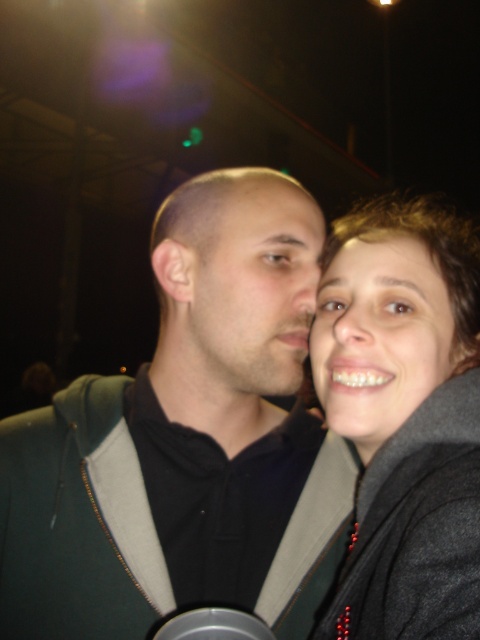
Is matte black face at center bigger than metallic silver cup at center?

Yes, matte black face at center is bigger than metallic silver cup at center.

Where is `matte black face at center`? matte black face at center is located at coordinates (253, 285).

Can you confirm if dark green hoodie at center is smaller than matte black face at center?

No, dark green hoodie at center is not smaller than matte black face at center.

Is dark green hoodie at center bigger than matte black face at center?

Indeed, dark green hoodie at center has a larger size compared to matte black face at center.

Is point (36, 582) positioned behind point (248, 304)?

Yes, it is behind point (248, 304).

Find the location of a particular element. This screenshot has height=640, width=480. dark green hoodie at center is located at coordinates (180, 451).

Can you confirm if smooth skin face at center is positioned above metallic silver cup at center?

Indeed, smooth skin face at center is positioned over metallic silver cup at center.

Between point (375, 268) and point (187, 618), which one is positioned behind?

Positioned behind is point (375, 268).

Is point (407, 352) less distant than point (177, 614)?

That is True.

I want to click on smooth skin face at center, so click(379, 337).